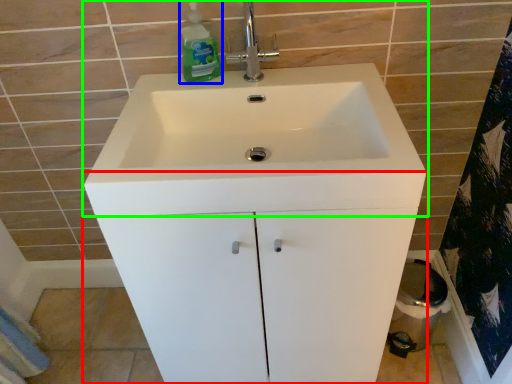
Question: Which object is positioned closest to bathroom cabinet (highlighted by a red box)? Select from cleaning product (highlighted by a blue box) and sink (highlighted by a green box).

Choices:
 (A) cleaning product
 (B) sink

Answer: (B)